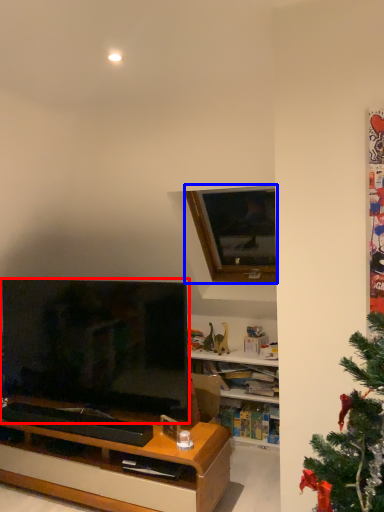
Question: Among these objects, which one is nearest to the camera, television (highlighted by a red box) or window (highlighted by a blue box)?

Choices:
 (A) television
 (B) window

Answer: (A)